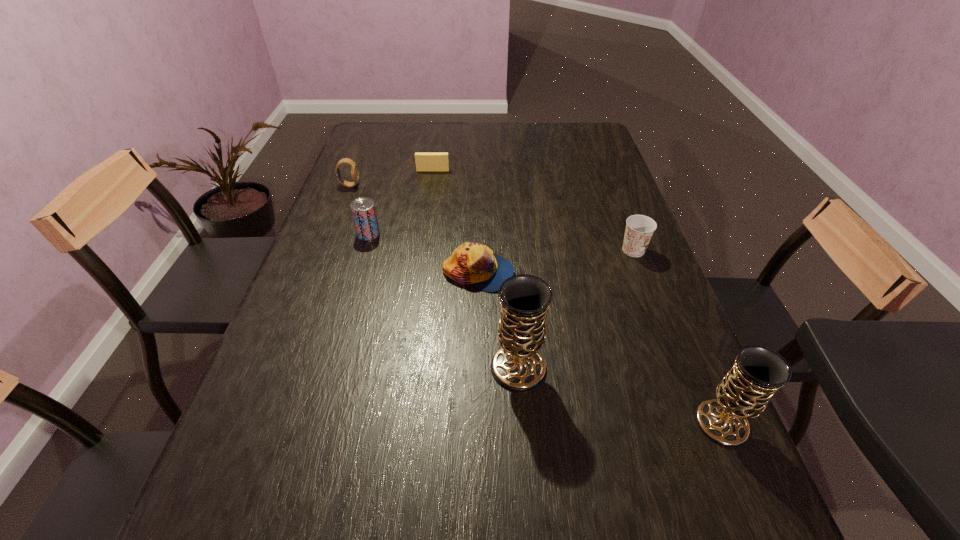
Considering the uniform spacing of chalices, where should an additional chalice be positioned on the left? Please locate a free spot. Please provide its 2D coordinates. Your answer should be formatted as a tuple, i.e. [(x, y)], where the tuple contains the x and y coordinates of a point satisfying the conditions above.

[(350, 322)]